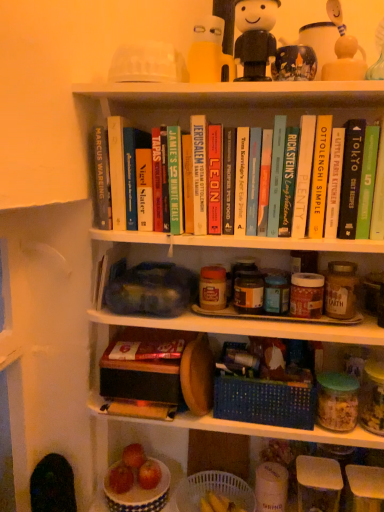
Question: Does point (157, 448) appear closer or farther from the camera than point (240, 506)?

Choices:
 (A) farther
 (B) closer

Answer: (A)

Question: In terms of size, does white ceramic bowl at lower left, positioned as the first shelf in bottom-to-top order, appear bigger or smaller than white plastic basket at lower center, which ranks as the 1th basket in bottom-to-top order?

Choices:
 (A) small
 (B) big

Answer: (B)

Question: Which is nearer to the white ceramic bowl at lower left, positioned as the first shelf in bottom-to-top order?

Choices:
 (A) hardcover book at center, which ranks as the 7th book in left-to-right order
 (B) red matte apple at lower center, which is the 1th apple from right to left
 (C) hardcover book at center, which appears as the sixth book when viewed from the left
 (D) blue woven basket at center, the 1th basket from the top
 (E) matte plastic containers at center, the 1th shelf when ordered from top to bottom

Answer: (B)

Question: Estimate the real-world distances between objects in this image. Which object is closer to the hardcover book at center, which is the 11th book from right to left?

Choices:
 (A) hardcover book at upper center, which is the tenth book in left-to-right order
 (B) hardcover book at center, arranged as the 8th book when viewed from the right
 (C) yellow matte cup at upper center, which is the first toy from left to right
 (D) hardcover book at center, the tenth book positioned from the right
 (E) red matte apple at lower left, which is the 1th apple in left-to-right order

Answer: (D)